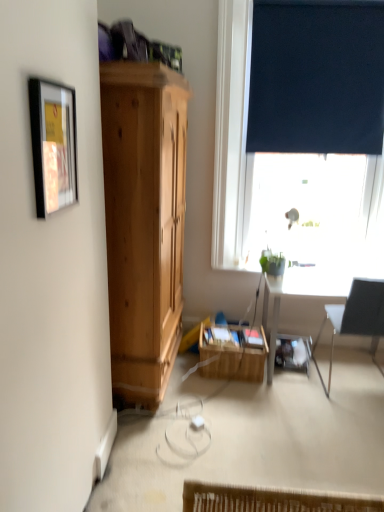
Question: Does dark blue fabric at upper right appear on the right side of black fabric chair at right?

Choices:
 (A) yes
 (B) no

Answer: (B)

Question: Is dark blue fabric at upper right not near black fabric chair at right?

Choices:
 (A) no
 (B) yes

Answer: (B)

Question: Can you confirm if dark blue fabric at upper right is smaller than black fabric chair at right?

Choices:
 (A) yes
 (B) no

Answer: (A)

Question: Is dark blue fabric at upper right turned away from black fabric chair at right?

Choices:
 (A) yes
 (B) no

Answer: (B)

Question: Can you confirm if dark blue fabric at upper right is shorter than black fabric chair at right?

Choices:
 (A) yes
 (B) no

Answer: (B)

Question: Is dark blue fabric at upper right further to the viewer compared to black fabric chair at right?

Choices:
 (A) no
 (B) yes

Answer: (B)

Question: Can you confirm if matte black picture frame at upper left is smaller than dark blue fabric at upper right?

Choices:
 (A) no
 (B) yes

Answer: (B)

Question: Is the position of matte black picture frame at upper left less distant than that of dark blue fabric at upper right?

Choices:
 (A) yes
 (B) no

Answer: (A)

Question: Would you consider matte black picture frame at upper left to be distant from dark blue fabric at upper right?

Choices:
 (A) no
 (B) yes

Answer: (B)

Question: From the image's perspective, is matte black picture frame at upper left below dark blue fabric at upper right?

Choices:
 (A) yes
 (B) no

Answer: (A)

Question: Is matte black picture frame at upper left thinner than dark blue fabric at upper right?

Choices:
 (A) no
 (B) yes

Answer: (A)

Question: Is matte black picture frame at upper left wider than dark blue fabric at upper right?

Choices:
 (A) yes
 (B) no

Answer: (A)

Question: Is dark blue roller blind at upper right outside of black fabric chair at right?

Choices:
 (A) no
 (B) yes

Answer: (B)